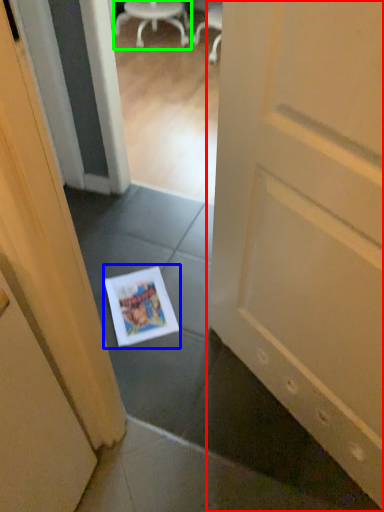
Question: Based on their relative distances, which object is farther from door (highlighted by a red box)? Choose from magazine (highlighted by a blue box) and chair (highlighted by a green box).

Choices:
 (A) magazine
 (B) chair

Answer: (B)